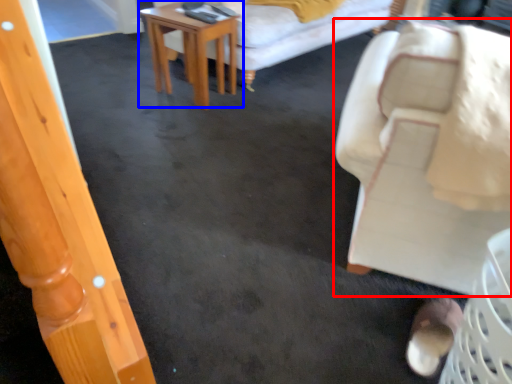
Question: Which point is further to the camera, chair (highlighted by a red box) or table (highlighted by a blue box)?

Choices:
 (A) chair
 (B) table

Answer: (B)